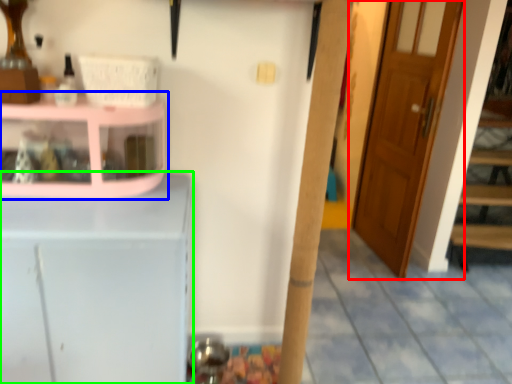
Question: Considering the real-world distances, which object is closest to door (highlighted by a red box)? shelf (highlighted by a blue box) or cabinetry (highlighted by a green box).

Choices:
 (A) shelf
 (B) cabinetry

Answer: (A)